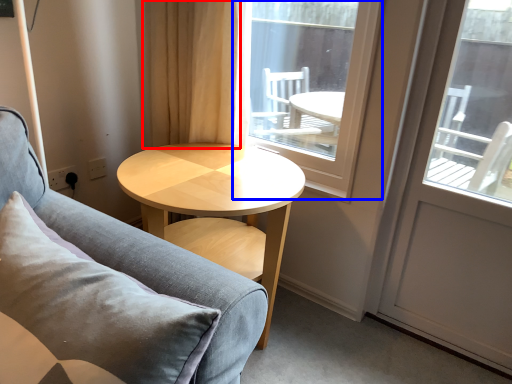
Question: Among these objects, which one is farthest to the camera, curtain (highlighted by a red box) or window (highlighted by a blue box)?

Choices:
 (A) curtain
 (B) window

Answer: (A)